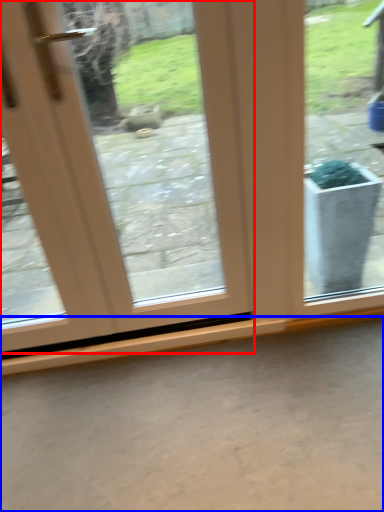
Question: Which object appears farthest to the camera in this image, door (highlighted by a red box) or concrete (highlighted by a blue box)?

Choices:
 (A) door
 (B) concrete

Answer: (B)